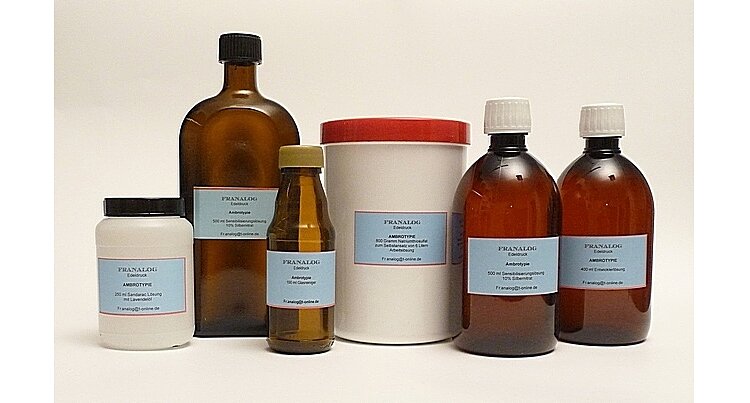
At what (x,y) coordinates should I click in order to perform the action: click on wall. Please return your answer as a coordinate pair (x, y). The image size is (750, 403). Looking at the image, I should click on (525, 42).